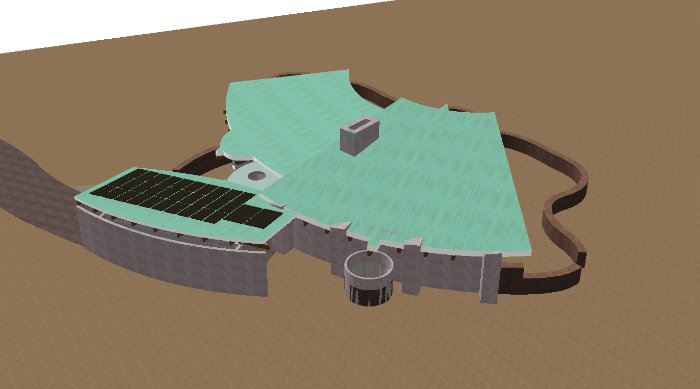
Image resolution: width=700 pixels, height=389 pixels. In order to click on entrance in this screenshot , I will do `click(582, 263)`.